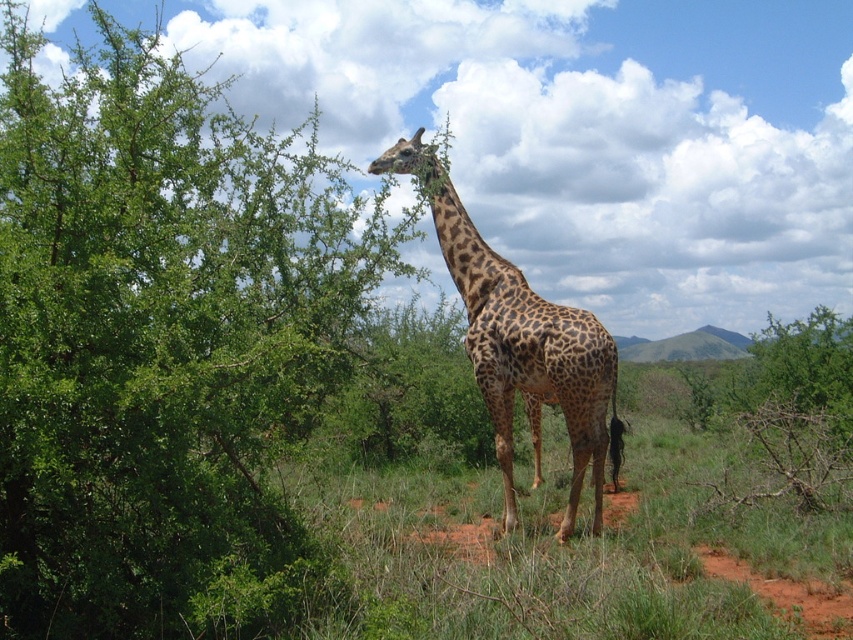
You are a bird flying above the scene. You see the green leafy tree at upper left and the spotted fur giraffe at center. Which one is taller?

The green leafy tree at upper left is taller than the spotted fur giraffe at center.

You are a bird flying over the scene and want to land on the green leafy tree at upper left or the spotted fur giraffe at center. Which one has a wider surface for landing?

The green leafy tree at upper left might be wider than the spotted fur giraffe at center, so it has a wider surface for landing.